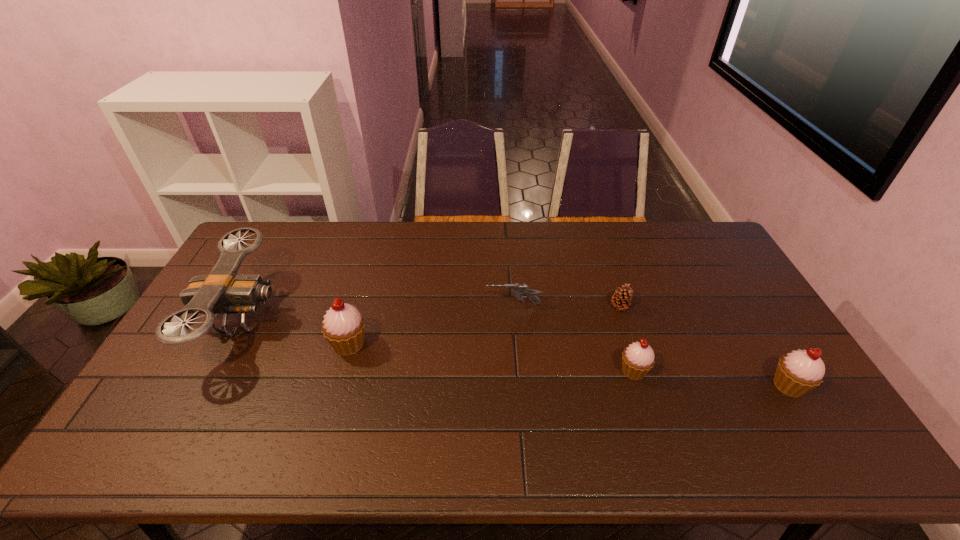
Identify the location of vacant point located 0.330m on the left of the rightmost object. Image resolution: width=960 pixels, height=540 pixels. (646, 386).

I want to click on vacant region located 0.370m on the front-facing side of the drone, so click(x=401, y=319).

Image resolution: width=960 pixels, height=540 pixels. Find the location of `vacant space located 0.200m on the right of the pinecone`. vacant space located 0.200m on the right of the pinecone is located at coordinates (692, 307).

Where is `free spot located at the barrel of the gun`? Image resolution: width=960 pixels, height=540 pixels. free spot located at the barrel of the gun is located at coordinates (470, 305).

Find the location of a particular element. vacant space located 0.050m at the barrel of the gun is located at coordinates (470, 305).

Identify the location of free space located 0.240m at the barrel of the gun. This screenshot has width=960, height=540. (411, 305).

This screenshot has height=540, width=960. Find the location of `object present at the near edge`. object present at the near edge is located at coordinates (798, 372).

At what (x,y) coordinates should I click in order to perform the action: click on object that is at the left edge. Please return your answer as a coordinate pair (x, y). The width and height of the screenshot is (960, 540). Looking at the image, I should click on (223, 291).

The image size is (960, 540). Identify the location of object situated at the right edge. (798, 372).

This screenshot has height=540, width=960. I want to click on object that is at the near right corner, so click(798, 372).